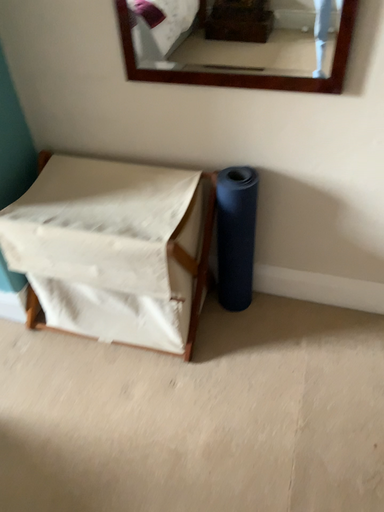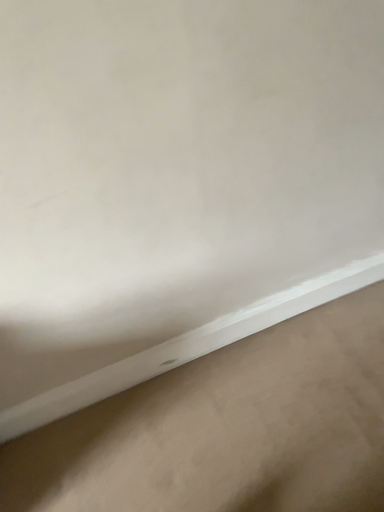
Question: Which way did the camera rotate in the video?

Choices:
 (A) rotated right
 (B) rotated left

Answer: (A)